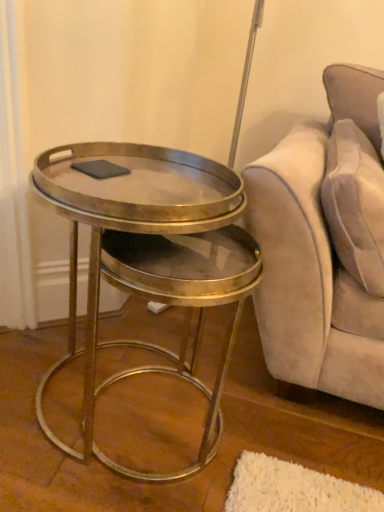
Question: Are metallic/goldenobject at left and gray matte pad at center beside each other?

Choices:
 (A) no
 (B) yes

Answer: (A)

Question: Is metallic/goldenobject at left positioned in front of gray matte pad at center?

Choices:
 (A) no
 (B) yes

Answer: (B)

Question: Is gray matte pad at center at the back of metallic/goldenobject at left?

Choices:
 (A) no
 (B) yes

Answer: (A)

Question: From the image's perspective, does metallic/goldenobject at left appear lower than gray matte pad at center?

Choices:
 (A) yes
 (B) no

Answer: (A)

Question: From a real-world perspective, is metallic/goldenobject at left positioned over gray matte pad at center based on gravity?

Choices:
 (A) no
 (B) yes

Answer: (A)

Question: Is gray matte pad at center bigger or smaller than suede-like beige pillow at upper right?

Choices:
 (A) big
 (B) small

Answer: (B)

Question: In terms of height, does gray matte pad at center look taller or shorter compared to suede-like beige pillow at upper right?

Choices:
 (A) short
 (B) tall

Answer: (A)

Question: Is gray matte pad at center wider or thinner than suede-like beige pillow at upper right?

Choices:
 (A) wide
 (B) thin

Answer: (B)

Question: Visually, is gray matte pad at center positioned to the left or to the right of suede-like beige pillow at upper right?

Choices:
 (A) right
 (B) left

Answer: (B)

Question: Do you think gray matte pad at center is within metallic/goldenobject at left, or outside of it?

Choices:
 (A) outside
 (B) inside

Answer: (B)

Question: Visually, is gray matte pad at center positioned to the left or to the right of metallic/goldenobject at left?

Choices:
 (A) left
 (B) right

Answer: (A)

Question: Considering their positions, is gray matte pad at center located in front of or behind metallic/goldenobject at left?

Choices:
 (A) front
 (B) behind

Answer: (B)

Question: Considering the positions of gray matte pad at center and metallic/goldenobject at left in the image, is gray matte pad at center bigger or smaller than metallic/goldenobject at left?

Choices:
 (A) small
 (B) big

Answer: (A)

Question: Considering their positions, is suede-like beige pillow at upper right located in front of or behind gray matte pad at center?

Choices:
 (A) front
 (B) behind

Answer: (A)

Question: From a real-world perspective, is suede-like beige pillow at upper right positioned above or below gray matte pad at center?

Choices:
 (A) below
 (B) above

Answer: (A)